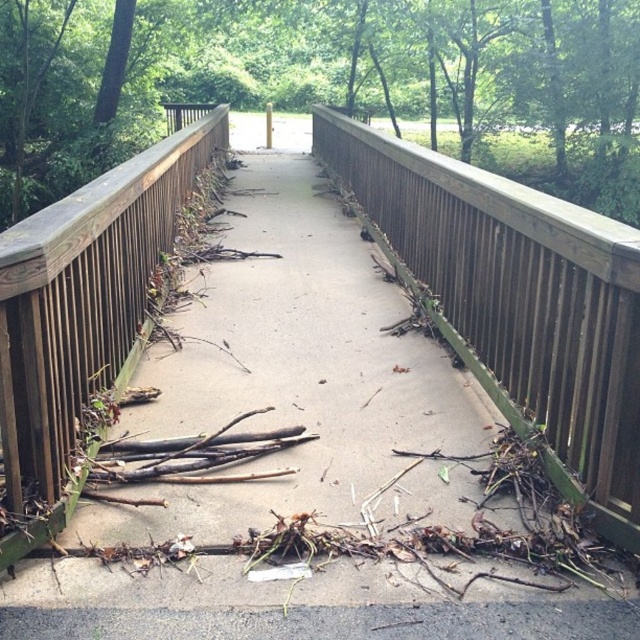
Can you confirm if brown wooden rail at center is wider than brown wooden balustrade at left?

Correct, the width of brown wooden rail at center exceeds that of brown wooden balustrade at left.

Based on the photo, between brown wooden rail at center and brown wooden balustrade at left, which one appears on the right side from the viewer's perspective?

brown wooden rail at center is more to the right.

Who is more distant from viewer, (554, 477) or (19, 266)?

The point (554, 477) is behind.

The height and width of the screenshot is (640, 640). In order to click on brown wooden rail at center in this screenshot , I will do (x=515, y=301).